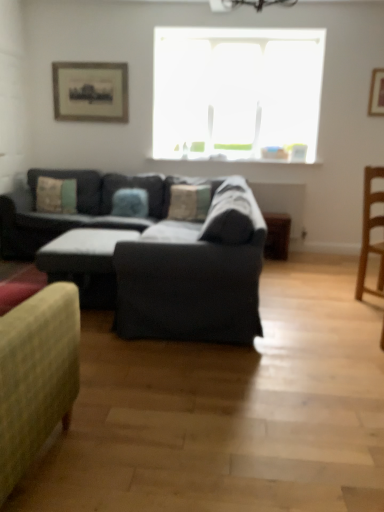
Find the location of a particular element. The height and width of the screenshot is (512, 384). vacant space in front of dark gray fabric couch at center is located at coordinates [221, 386].